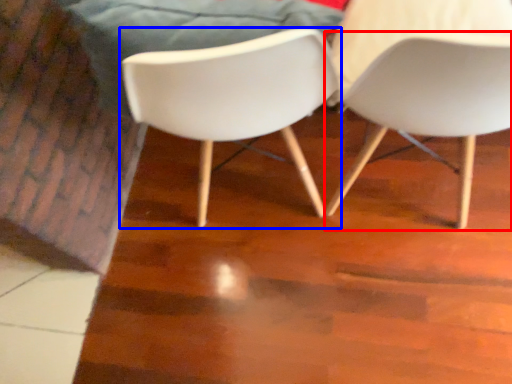
Question: Which object is closer to the camera taking this photo, chair (highlighted by a red box) or chair (highlighted by a blue box)?

Choices:
 (A) chair
 (B) chair

Answer: (A)